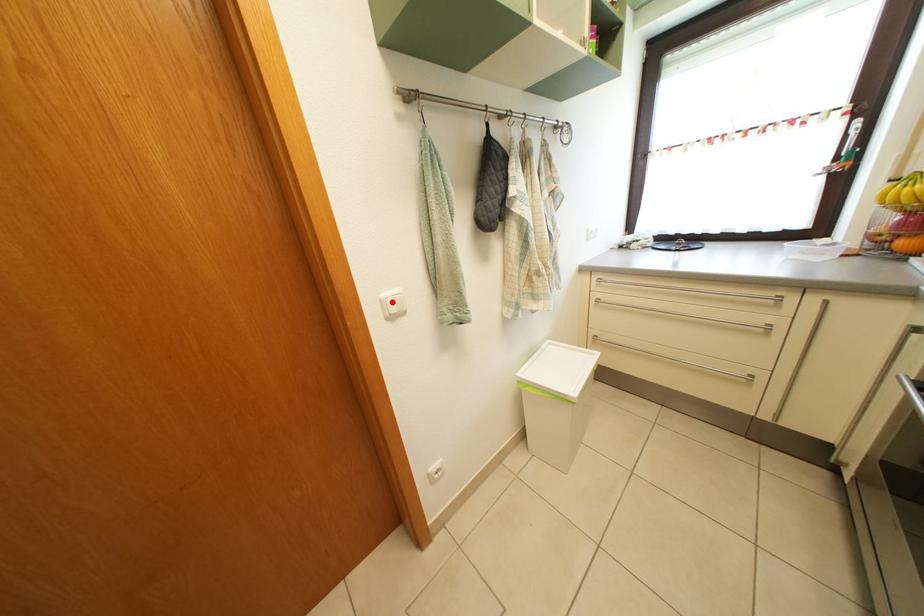
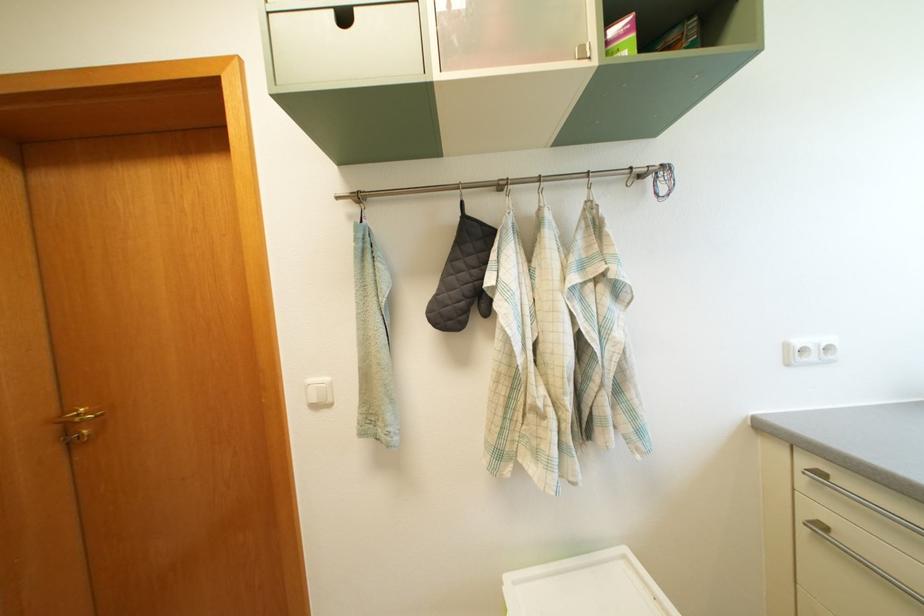
Question: I am providing you with two images of the same scene from different viewpoints. In image1, a red point is highlighted. Considering the same 3D point in image2, which of the following is correct?

Choices:
 (A) It is closer
 (B) It is farther

Answer: (B)